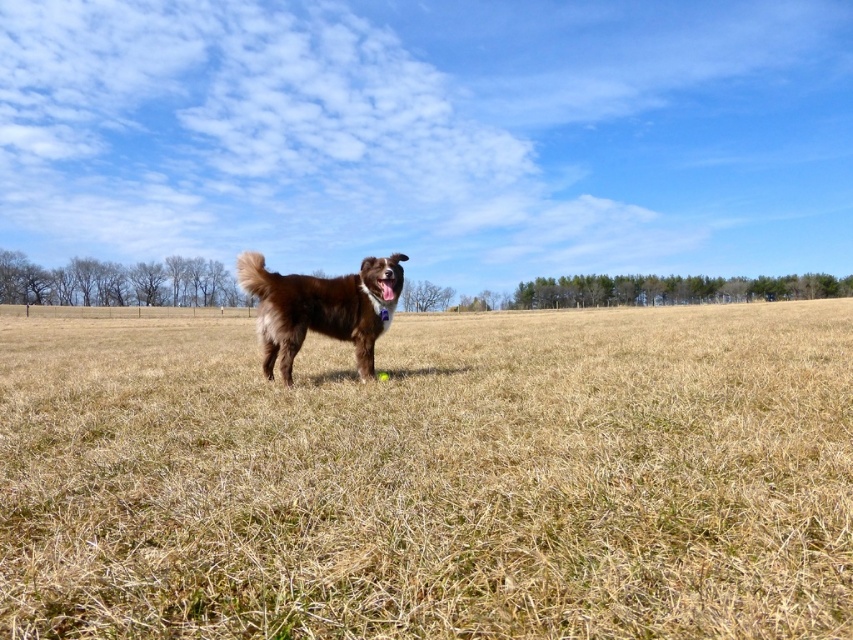
Question: Is dry grass at center further to camera compared to brown furry dog at center?

Choices:
 (A) no
 (B) yes

Answer: (A)

Question: Does dry grass at center lie behind brown furry dog at center?

Choices:
 (A) no
 (B) yes

Answer: (A)

Question: Among these objects, which one is nearest to the camera?

Choices:
 (A) brown furry dog at center
 (B) dry grass at center

Answer: (B)

Question: Which point is farther from the camera taking this photo?

Choices:
 (A) (509, 499)
 (B) (273, 275)

Answer: (B)

Question: Can you confirm if dry grass at center is positioned to the right of brown furry dog at center?

Choices:
 (A) yes
 (B) no

Answer: (B)

Question: Which object appears farthest from the camera in this image?

Choices:
 (A) dry grass at center
 (B) brown furry dog at center

Answer: (B)